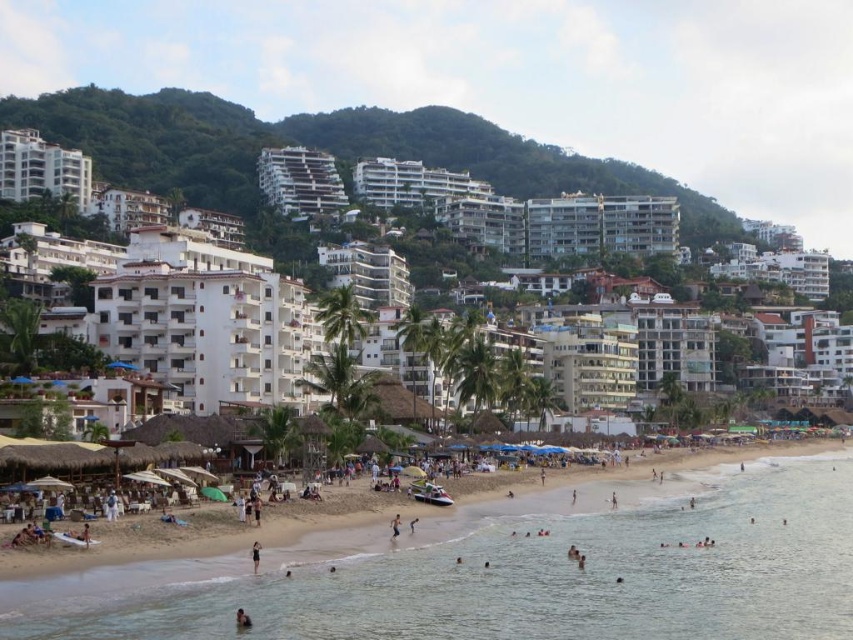
Question: Which of the following is the farthest from the observer?

Choices:
 (A) (236, 611)
 (B) (718, 579)
 (C) (148, 109)
 (D) (254, 560)

Answer: (C)

Question: Observing the image, what is the correct spatial positioning of white glossy building at upper left in reference to black matte swimsuit at lower center?

Choices:
 (A) right
 (B) left

Answer: (B)

Question: Which is farther from the brown skin at lower center?

Choices:
 (A) clear blue water at lower center
 (B) black matte swimsuit at lower center
 (C) white glossy building at upper left
 (D) green leafy hillside at upper center

Answer: (D)

Question: Is the position of green leafy hillside at upper center less distant than that of brown skin at lower center?

Choices:
 (A) no
 (B) yes

Answer: (A)

Question: Does brown skin at lower center have a lesser width compared to black matte swimsuit at lower center?

Choices:
 (A) no
 (B) yes

Answer: (A)

Question: Which point is farther to the camera?

Choices:
 (A) (289, 632)
 (B) (207, 122)

Answer: (B)